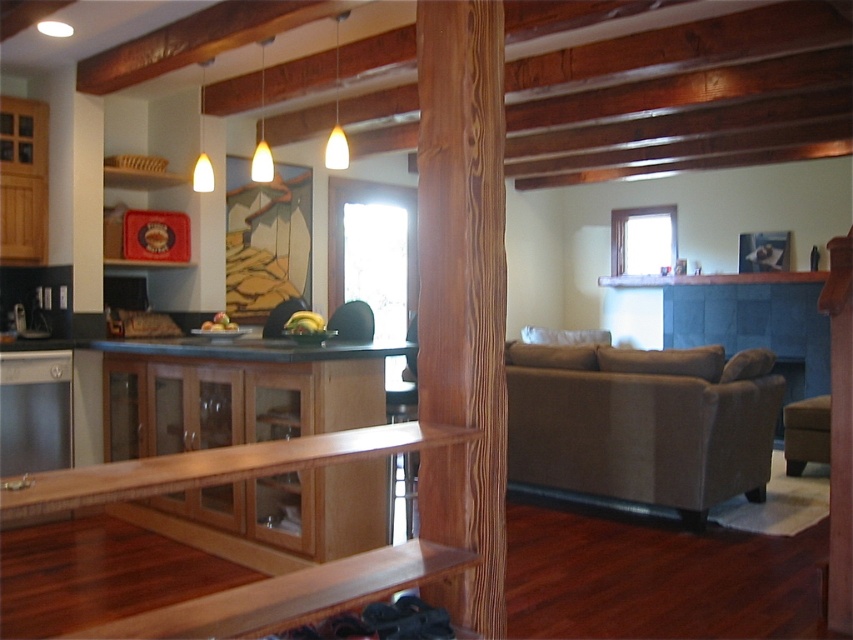
Who is shorter, satin stainless steel dishwasher at left or brown leather stool at lower right?

brown leather stool at lower right is shorter.

Can you confirm if satin stainless steel dishwasher at left is smaller than brown leather stool at lower right?

Correct, satin stainless steel dishwasher at left occupies less space than brown leather stool at lower right.

Which is in front, point (61, 454) or point (791, 474)?

Point (61, 454)

This screenshot has height=640, width=853. I want to click on satin stainless steel dishwasher at left, so click(x=35, y=410).

Is point (721, 452) behind point (793, 449)?

No, (721, 452) is closer to viewer.

Describe the element at coordinates (642, 422) in the screenshot. I see `beige fabric couch at lower right` at that location.

What do you see at coordinates (642, 422) in the screenshot? The image size is (853, 640). I see `beige fabric couch at lower right` at bounding box center [642, 422].

Where is `beige fabric couch at lower right`? beige fabric couch at lower right is located at coordinates (642, 422).

Which is above, beige fabric couch at lower right or satin stainless steel dishwasher at left?

Positioned higher is satin stainless steel dishwasher at left.

Consider the image. Does beige fabric couch at lower right have a smaller size compared to satin stainless steel dishwasher at left?

No, beige fabric couch at lower right is not smaller than satin stainless steel dishwasher at left.

Where is `beige fabric couch at lower right`? This screenshot has width=853, height=640. beige fabric couch at lower right is located at coordinates (642, 422).